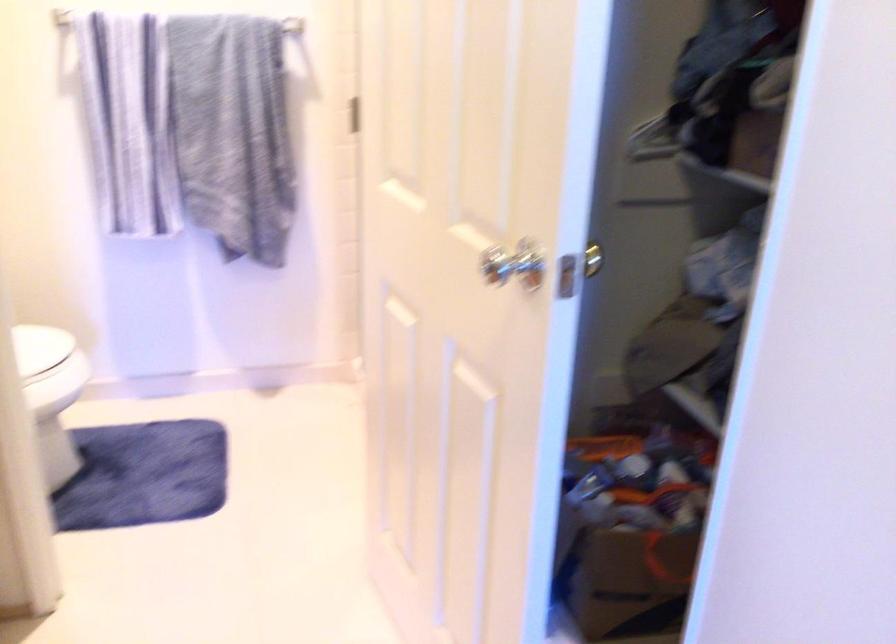
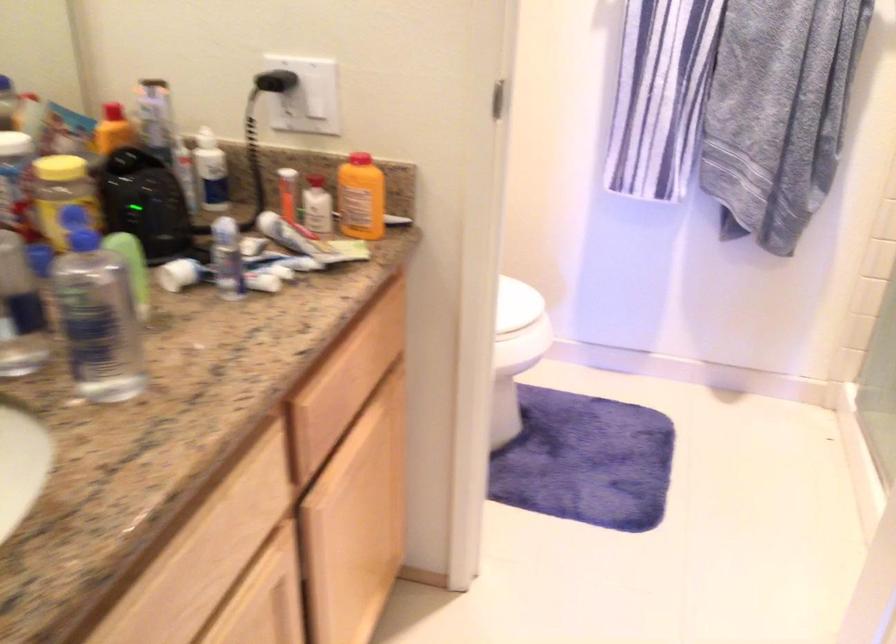
Question: The camera is either moving clockwise (left) or counter-clockwise (right) around the object. The first image is from the beginning of the video and the second image is from the end. Is the camera moving left or right when shooting the video?

Choices:
 (A) Left
 (B) Right

Answer: (B)